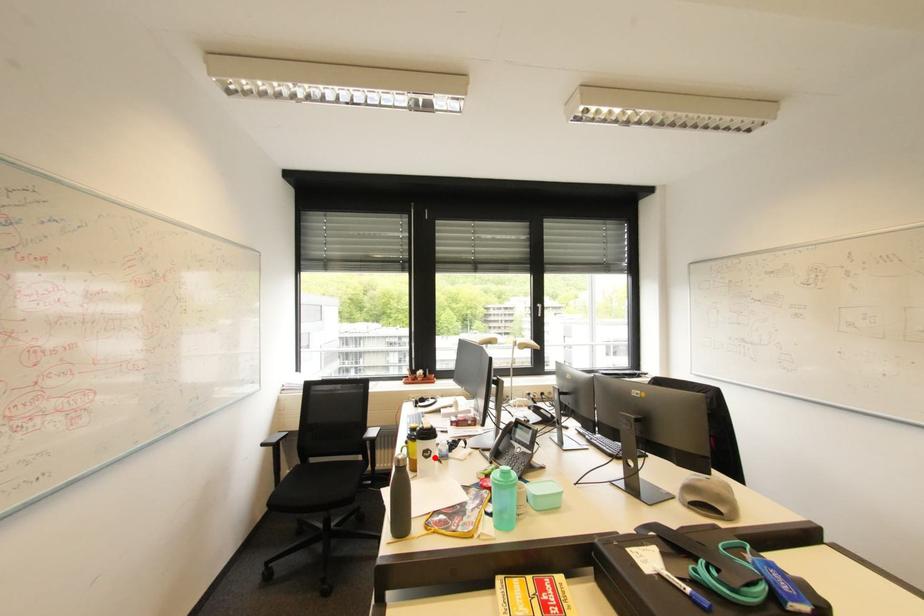
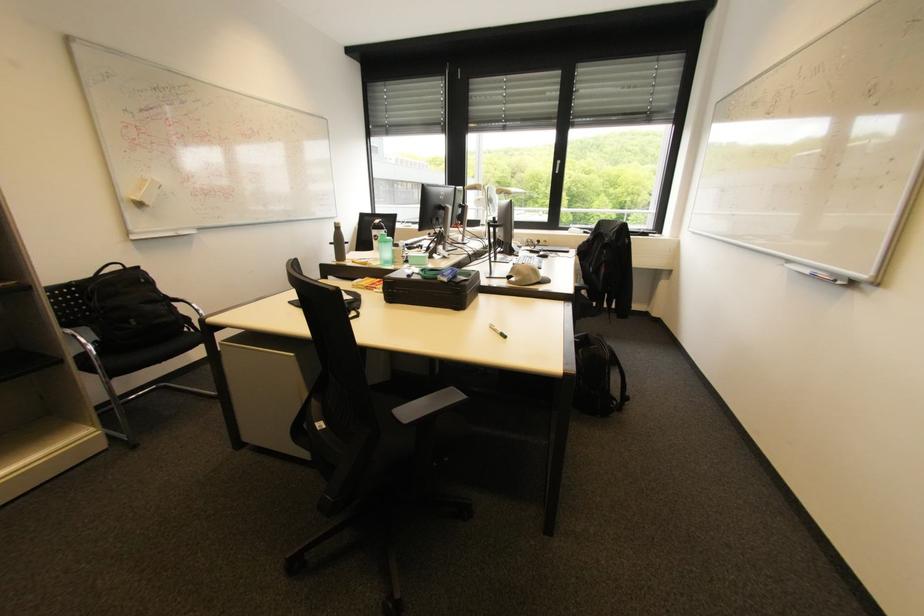
Find the pixel in the second image that matches the highlighted location in the first image.

(382, 240)